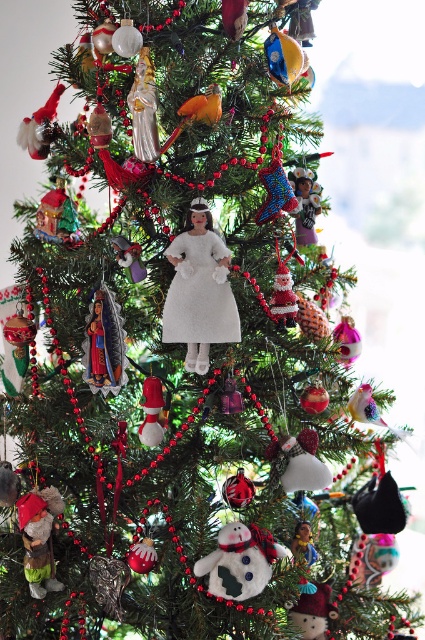
Question: Does matte brown gnome at lower left appear under shiny metallic angel at center?

Choices:
 (A) no
 (B) yes

Answer: (B)

Question: Estimate the real-world distances between objects in this image. Which object is closer to the fuzzy white snowman at center?

Choices:
 (A) satin santa at center
 (B) white matte doll at center
 (C) matte brown gnome at lower left
 (D) shiny metallic angel at center

Answer: (A)

Question: Does white matte doll at center have a smaller size compared to fuzzy white snowman at center?

Choices:
 (A) no
 (B) yes

Answer: (A)

Question: Which of the following is the farthest from the observer?

Choices:
 (A) matte brown gnome at lower left
 (B) satin santa at center

Answer: (A)

Question: Does fuzzy white snowman at center have a smaller size compared to shiny metallic angel at center?

Choices:
 (A) no
 (B) yes

Answer: (A)

Question: Which point appears closest to the camera in this image?

Choices:
 (A) (159, 429)
 (B) (51, 506)
 (C) (314, 196)
 (D) (166, 307)

Answer: (D)